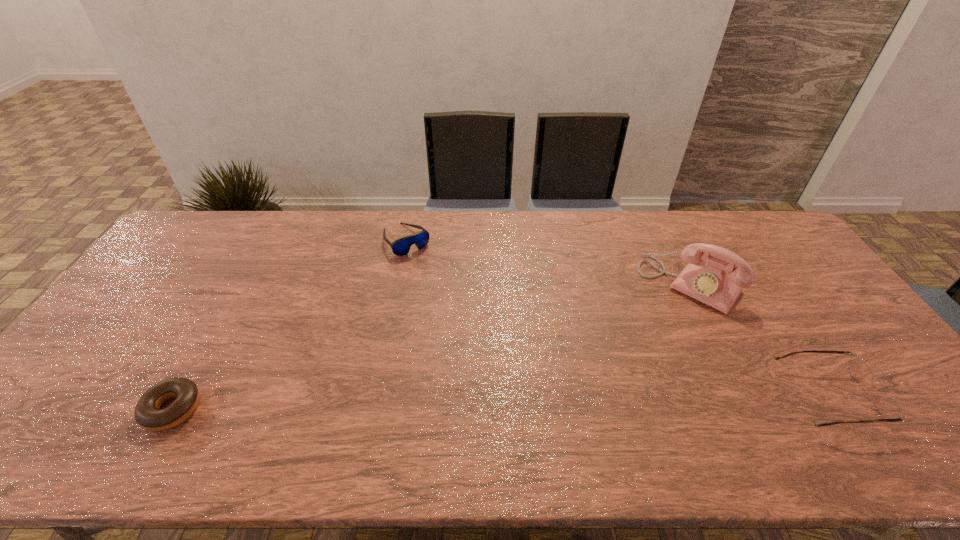
Where is `vacant space on the desktop that is between the leftmost object and the spectacles and is positioned on the dial of the tallest object`? The width and height of the screenshot is (960, 540). vacant space on the desktop that is between the leftmost object and the spectacles and is positioned on the dial of the tallest object is located at coordinates (600, 401).

This screenshot has width=960, height=540. I want to click on vacant space on the desktop that is between the shortest object and the spectacles and is positioned on the front-facing side of the sunglasses, so tap(536, 402).